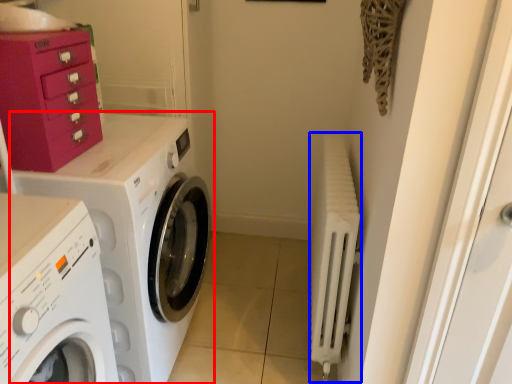
Question: Which point is further to the camera, washing machine (highlighted by a red box) or radiator (highlighted by a blue box)?

Choices:
 (A) washing machine
 (B) radiator

Answer: (B)